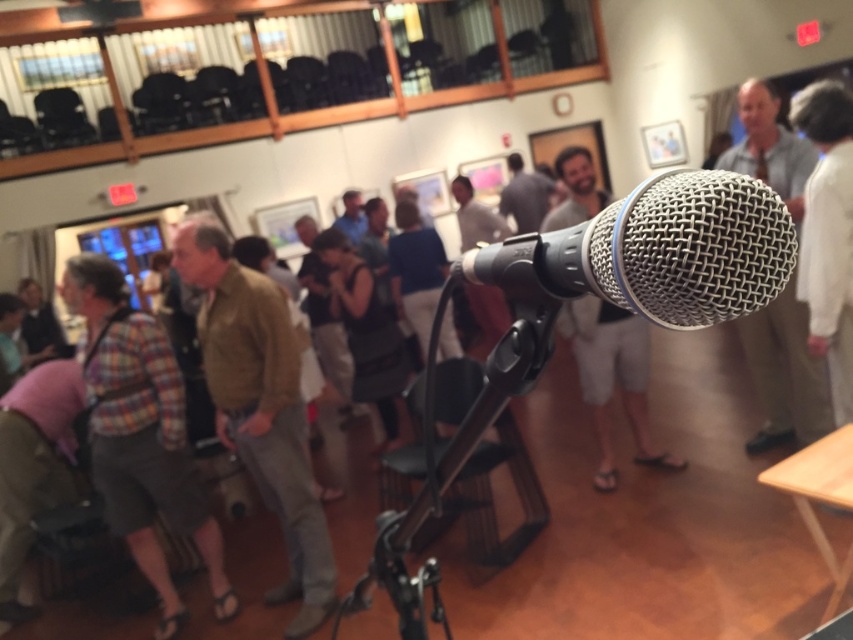
Which of these two, brown leather jacket at center or white fabric shirt at right, stands shorter?

Standing shorter between the two is white fabric shirt at right.

This screenshot has height=640, width=853. Identify the location of brown leather jacket at center. (260, 406).

Which of these two, light beige pants at center or white fabric shirt at right, stands shorter?

With less height is light beige pants at center.

Is light beige pants at center above white fabric shirt at right?

No, light beige pants at center is not above white fabric shirt at right.

Is point (764, 122) positioned in front of point (821, 131)?

That is False.

You are a GUI agent. You are given a task and a screenshot of the screen. Output one action in this format:
    pyautogui.click(x=<x>, y=<y>)
    Task: Click on the light beige pants at center
    
    Given the screenshot: What is the action you would take?
    pyautogui.click(x=784, y=374)

Is plaid fabric shirt at left above brown leather jacket at center?

Incorrect, plaid fabric shirt at left is not positioned above brown leather jacket at center.

In the scene shown: Who is more distant from viewer, [135,387] or [292,387]?

Point [135,387]

The width and height of the screenshot is (853, 640). Identify the location of plaid fabric shirt at left. (141, 435).